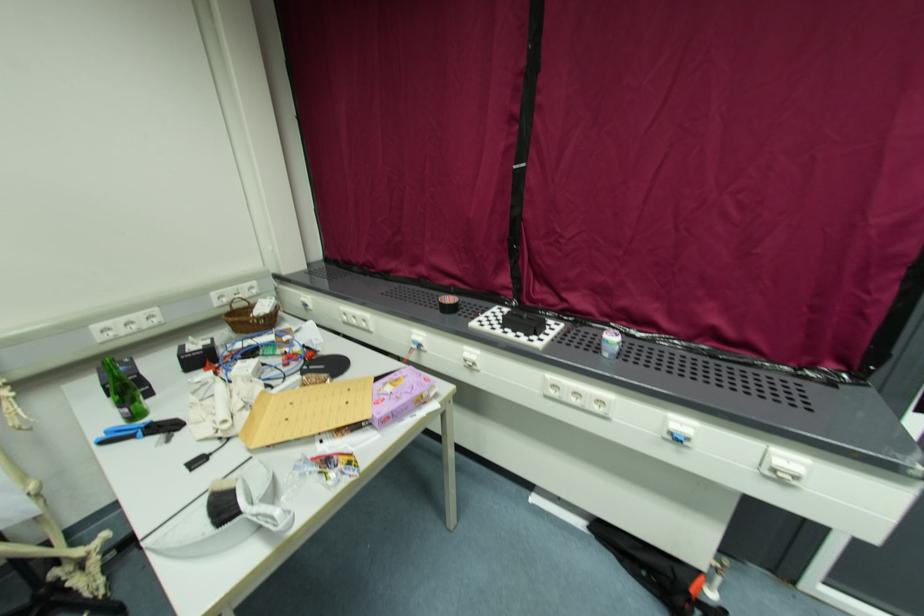
Find where to lift the small patterned cup. Please return your answer as a coordinate pair (x, y).

(447, 304)